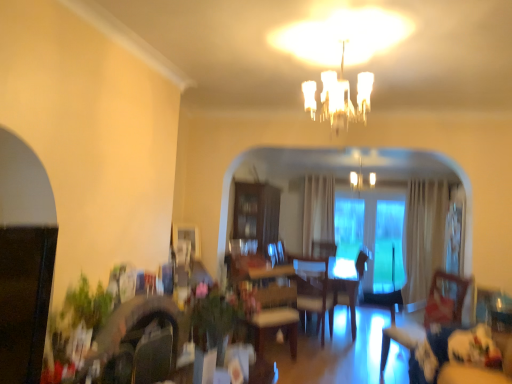
Question: Looking at the image, does white frosted glass chandelier at upper center seem bigger or smaller compared to transparent glass door at center?

Choices:
 (A) big
 (B) small

Answer: (B)

Question: Considering their positions, is white frosted glass chandelier at upper center located in front of or behind transparent glass door at center?

Choices:
 (A) front
 (B) behind

Answer: (A)

Question: Which of these objects is positioned farthest from the velvet blue couch at lower right?

Choices:
 (A) transparent glass door at center
 (B) wooden swivel chair at lower right
 (C) light brown leather armchair at center
 (D) clear glass chandelier at upper center
 (E) white frosted glass chandelier at upper center

Answer: (E)

Question: Considering the real-world distances, which object is closest to the clear glass chandelier at upper center?

Choices:
 (A) light brown leather armchair at center
 (B) white frosted glass chandelier at upper center
 (C) transparent glass door at center
 (D) velvet blue couch at lower right
 (E) wooden swivel chair at lower right

Answer: (E)